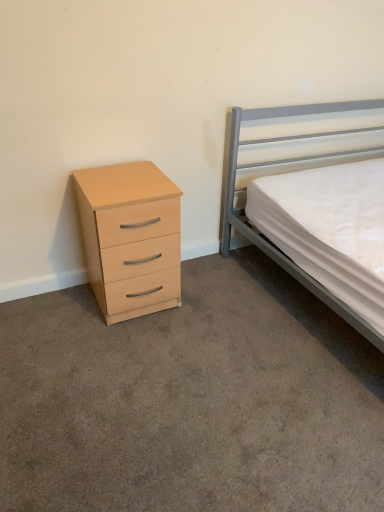
This screenshot has width=384, height=512. What are the coordinates of `unoccupied area in front of matte wood chest of drawers at left` in the screenshot? It's located at (124, 348).